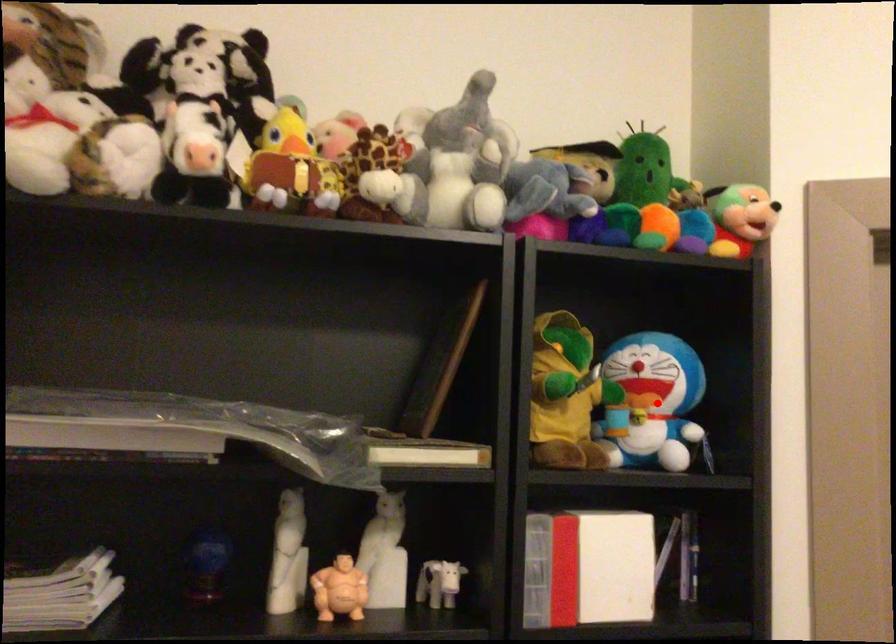
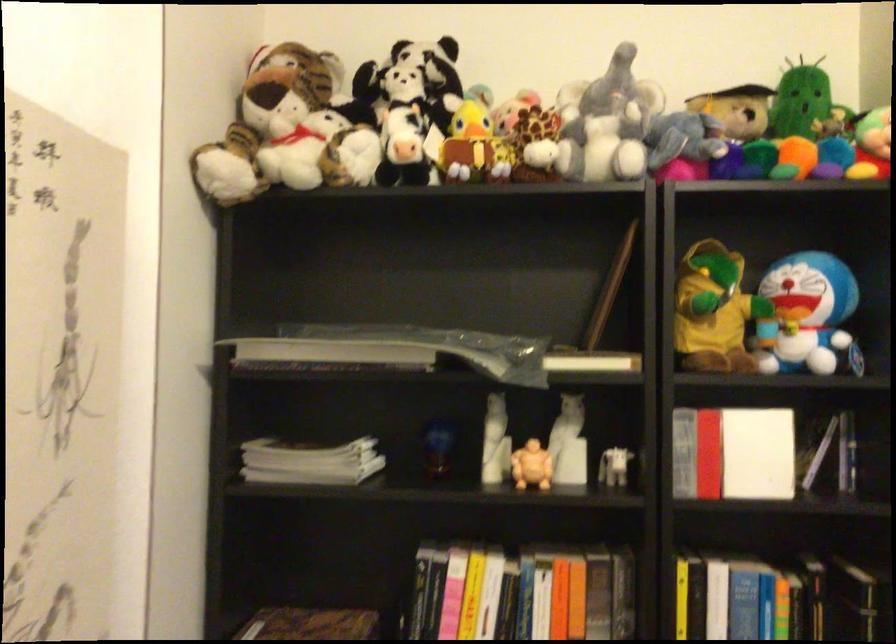
Question: I am providing you with two images of the same scene from different viewpoints. In image1, a red point is highlighted. Considering the same 3D point in image2, which of the following is correct?

Choices:
 (A) It is closer
 (B) It is farther

Answer: (B)